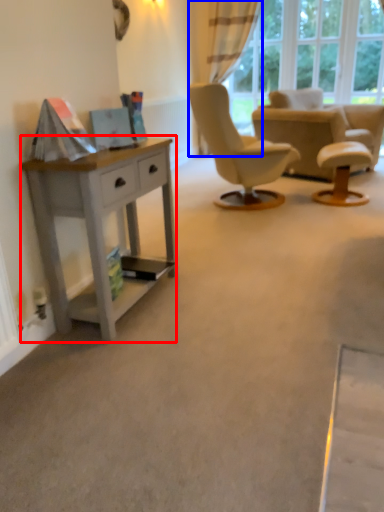
Question: Which of the following is the closest to the observer, desk (highlighted by a red box) or curtain (highlighted by a blue box)?

Choices:
 (A) desk
 (B) curtain

Answer: (A)